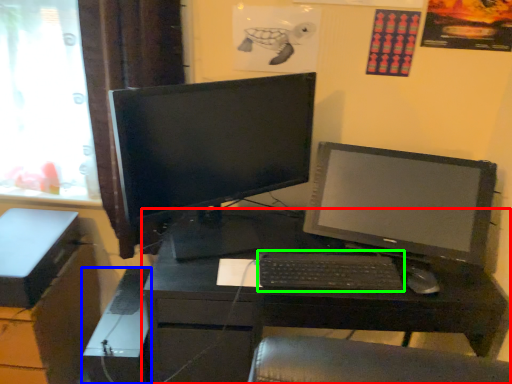
Question: Considering the real-world distances, which object is closest to desk (highlighted by a red box)? computer tower (highlighted by a blue box) or computer keyboard (highlighted by a green box).

Choices:
 (A) computer tower
 (B) computer keyboard

Answer: (B)